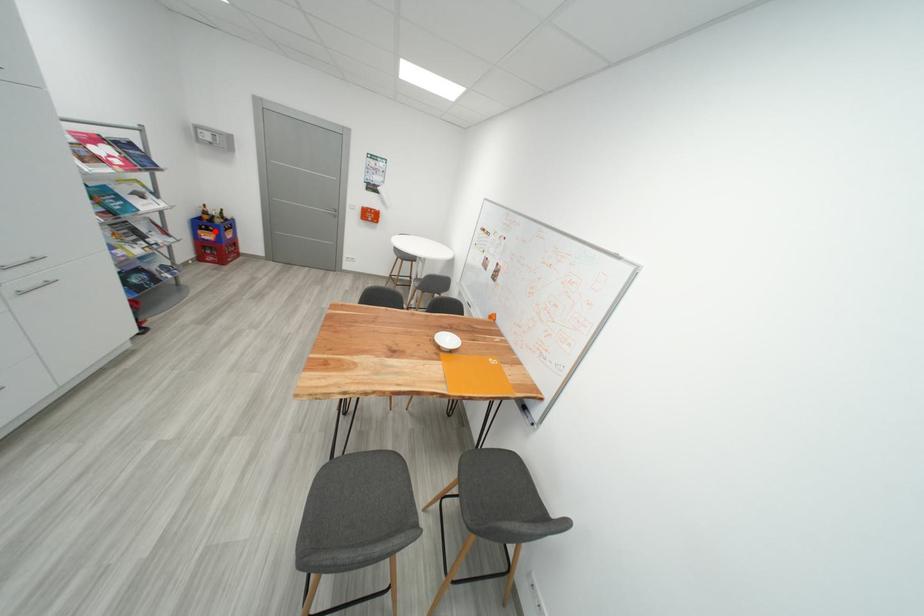
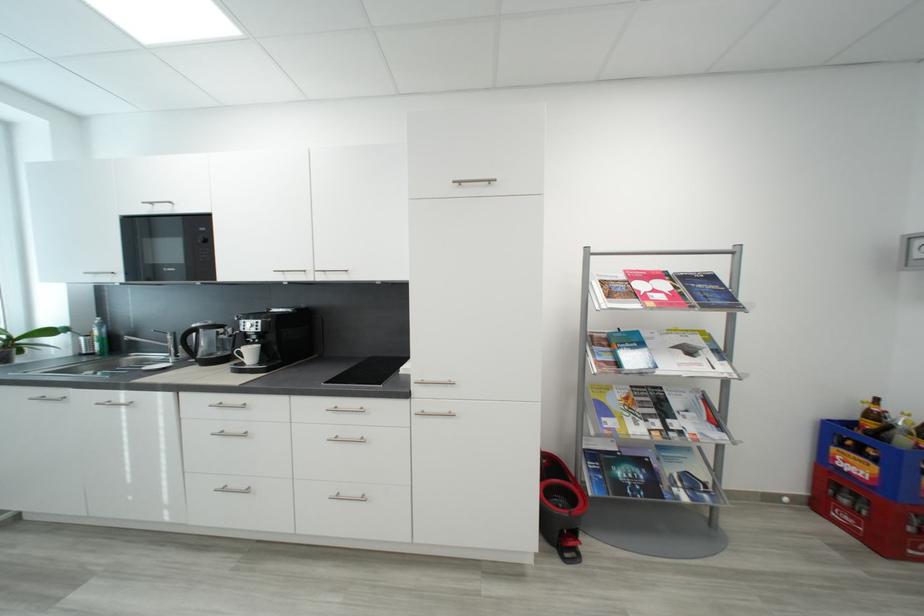
Question: I am providing you with two images of the same scene from different viewpoints. In image1, a red point is highlighted. Considering the same 3D point in image2, which of the following is correct?

Choices:
 (A) It is closer
 (B) It is farther

Answer: (A)